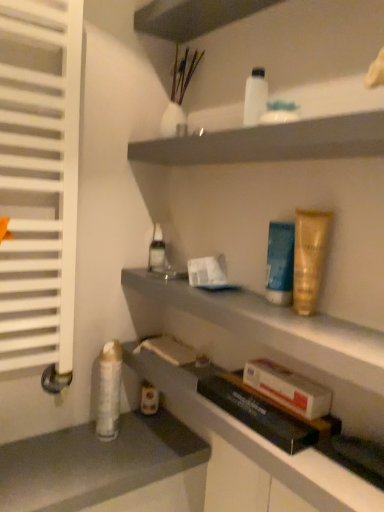
Question: From the image's perspective, is white glossy shelf at upper center, the second shelf in the bottom-to-top sequence, over white cardboard box at lower center?

Choices:
 (A) yes
 (B) no

Answer: (A)

Question: Considering the relative positions of white glossy shelf at upper center, the second shelf in the bottom-to-top sequence, and white cardboard box at lower center in the image provided, is white glossy shelf at upper center, the second shelf in the bottom-to-top sequence, in front of white cardboard box at lower center?

Choices:
 (A) no
 (B) yes

Answer: (B)

Question: Is white glossy shelf at upper center, the second shelf in the bottom-to-top sequence, next to white cardboard box at lower center and touching it?

Choices:
 (A) no
 (B) yes

Answer: (A)

Question: Could you tell me if white glossy shelf at upper center, which appears as the 1th shelf when viewed from the top, is facing white cardboard box at lower center?

Choices:
 (A) yes
 (B) no

Answer: (B)

Question: Is white glossy shelf at upper center, the second shelf in the bottom-to-top sequence, smaller than white cardboard box at lower center?

Choices:
 (A) yes
 (B) no

Answer: (B)

Question: Relative to white glossy lotion at upper center, which is the 1th toiletry from top to bottom, is white cardboard box at lower center in front or behind?

Choices:
 (A) front
 (B) behind

Answer: (A)

Question: In terms of width, does white cardboard box at lower center look wider or thinner when compared to white glossy lotion at upper center, positioned as the third toiletry in right-to-left order?

Choices:
 (A) wide
 (B) thin

Answer: (B)

Question: From their relative heights in the image, would you say white cardboard box at lower center is taller or shorter than white glossy lotion at upper center, the 3th toiletry when ordered from front to back?

Choices:
 (A) tall
 (B) short

Answer: (B)

Question: Choose the correct answer: Is white cardboard box at lower center inside white glossy lotion at upper center, positioned as the third toiletry in right-to-left order, or outside it?

Choices:
 (A) outside
 (B) inside

Answer: (A)

Question: Is white cardboard box at lower center to the left or to the right of blue matte tube at center-right, the fourth toiletry when ordered from top to bottom, in the image?

Choices:
 (A) left
 (B) right

Answer: (B)

Question: From the image's perspective, relative to blue matte tube at center-right, the 2th toiletry in the right-to-left sequence, is white cardboard box at lower center above or below?

Choices:
 (A) below
 (B) above

Answer: (A)

Question: Considering their positions, is white cardboard box at lower center located in front of or behind blue matte tube at center-right, the fourth toiletry when ordered from left to right?

Choices:
 (A) front
 (B) behind

Answer: (A)

Question: From a real-world perspective, is white cardboard box at lower center positioned above or below blue matte tube at center-right, the fourth toiletry when ordered from top to bottom?

Choices:
 (A) below
 (B) above

Answer: (A)

Question: From a real-world perspective, is gold metallic tube at upper right, arranged as the 3th toiletry when viewed from the top, above or below gray matte counter at lower left?

Choices:
 (A) below
 (B) above

Answer: (B)

Question: Considering the positions of gold metallic tube at upper right, the 5th toiletry viewed from the left, and gray matte counter at lower left in the image, is gold metallic tube at upper right, the 5th toiletry viewed from the left, taller or shorter than gray matte counter at lower left?

Choices:
 (A) short
 (B) tall

Answer: (B)